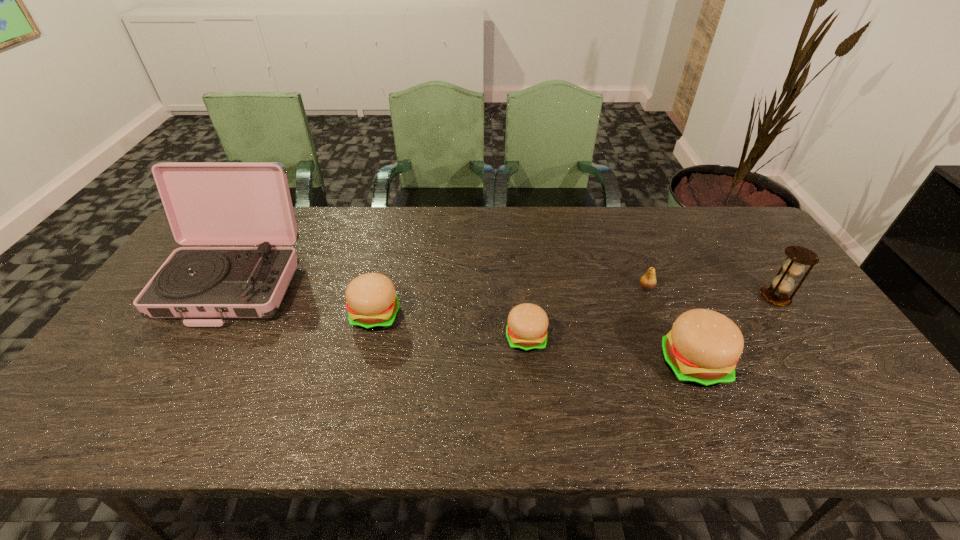
Identify which object is the closest to the tallest object. Please provide its 2D coordinates. Your answer should be formatted as a tuple, i.e. [(x, y)], where the tuple contains the x and y coordinates of a point satisfying the conditions above.

[(372, 304)]

I want to click on object that is the fourth closest to the fourth object from right to left, so click(x=207, y=203).

Point out which hamburger is positioned as the nearest to the third shortest object. Please provide its 2D coordinates. Your answer should be formatted as a tuple, i.e. [(x, y)], where the tuple contains the x and y coordinates of a point satisfying the conditions above.

[(526, 330)]

I want to click on hamburger that can be found as the third closest to the tallest object, so click(702, 349).

The height and width of the screenshot is (540, 960). I want to click on vacant space that satisfies the following two spatial constraints: 1. with the lid open on the rightmost object; 2. on the left side of the leftmost object, so click(x=226, y=298).

Locate an element on the screen. free spot that satisfies the following two spatial constraints: 1. with the lid open on the hourglass; 2. on the left side of the record player is located at coordinates (226, 298).

Where is `free space that satisfies the following two spatial constraints: 1. with the lid open on the pear; 2. on the right side of the leftmost object`? free space that satisfies the following two spatial constraints: 1. with the lid open on the pear; 2. on the right side of the leftmost object is located at coordinates (231, 288).